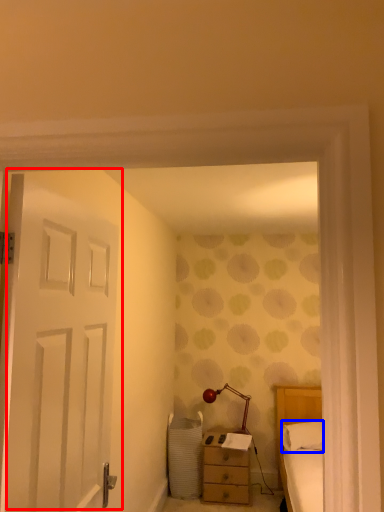
Question: Which of the following is the closest to the observer, door (highlighted by a red box) or throw pillow (highlighted by a blue box)?

Choices:
 (A) door
 (B) throw pillow

Answer: (A)